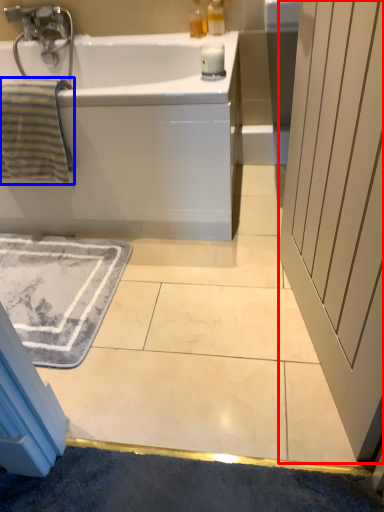
Question: Which point is closer to the camera, screen door (highlighted by a red box) or bath towel (highlighted by a blue box)?

Choices:
 (A) screen door
 (B) bath towel

Answer: (A)